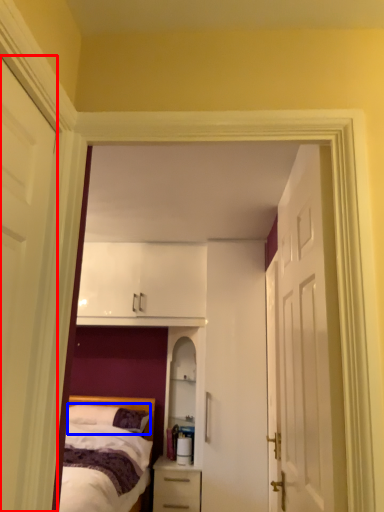
Question: Which of the following is the farthest to the observer, door (highlighted by a red box) or pillow (highlighted by a blue box)?

Choices:
 (A) door
 (B) pillow

Answer: (B)